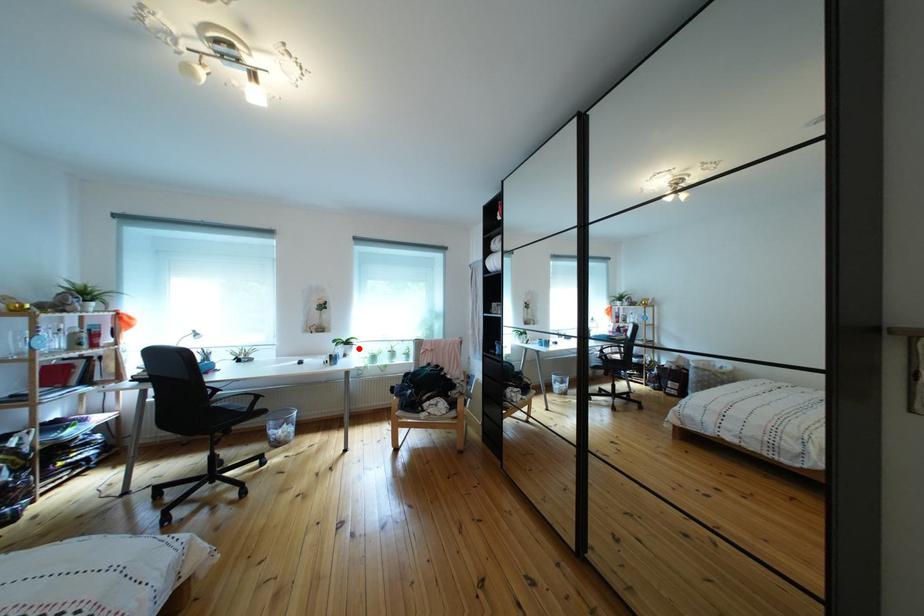
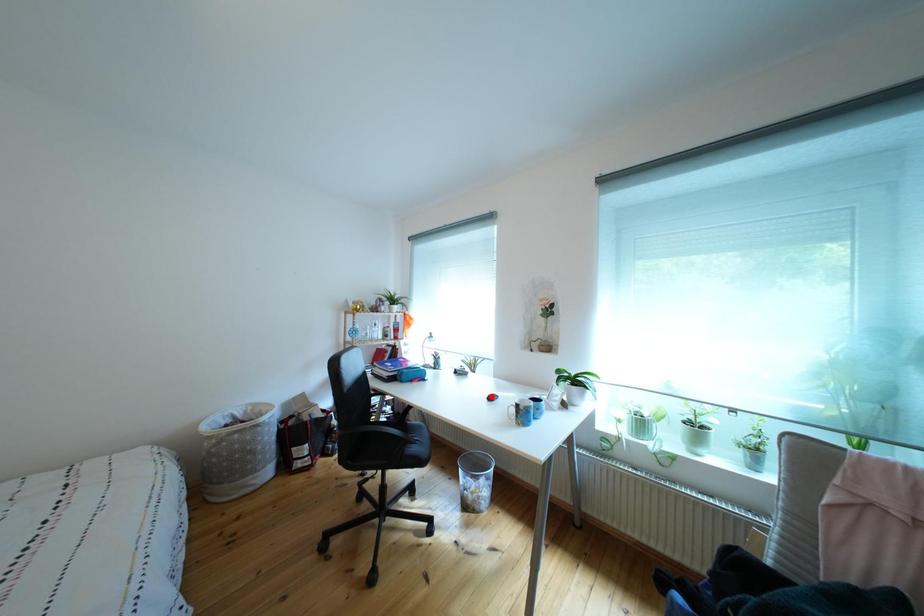
In the scene shown: I am providing you with two images of the same scene from different viewpoints. A red point is marked on the first image and another point is marked on the second image. Is the marked point in image1 the same physical position as the marked point in image2?

No